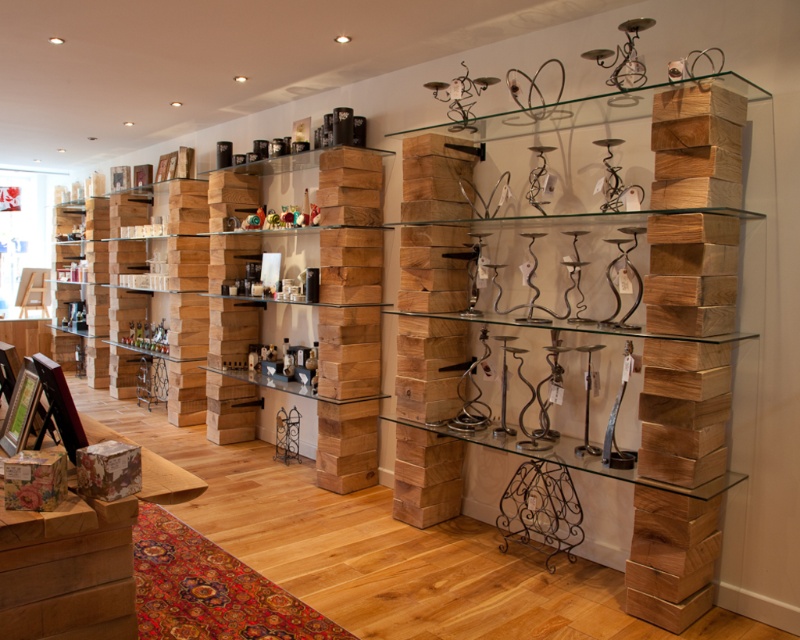
Is natural wood bookshelf at upper right wider than wooden shelves at center?

Yes, natural wood bookshelf at upper right is wider than wooden shelves at center.

Is natural wood bookshelf at upper right above wooden shelves at center?

Incorrect, natural wood bookshelf at upper right is not positioned above wooden shelves at center.

Who is more distant from viewer, (705, 595) or (333, 369)?

The point (333, 369) is behind.

Find the location of a particular element. natural wood bookshelf at upper right is located at coordinates (690, 276).